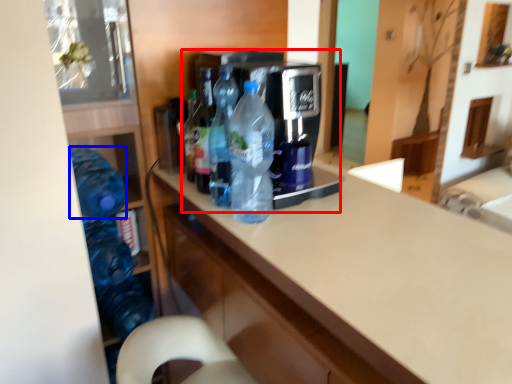
Question: Which of the following is the closest to the observer, appliance (highlighted by a red box) or bottle (highlighted by a blue box)?

Choices:
 (A) appliance
 (B) bottle

Answer: (A)